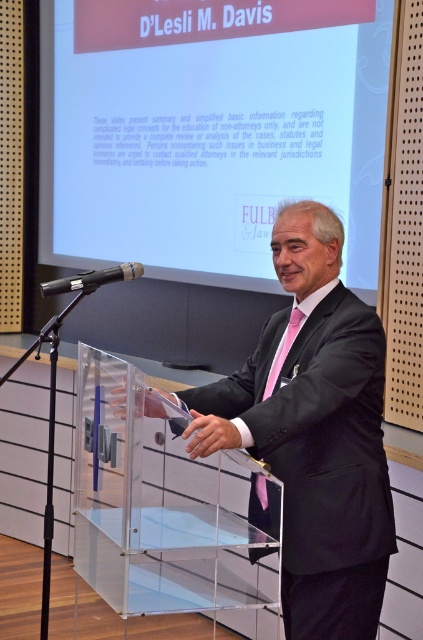
Question: Which of the following is the farthest from the observer?

Choices:
 (A) black glossy suit at center
 (B) black matte microphone at center
 (C) pink satin tie at center

Answer: (B)

Question: In this image, where is black glossy suit at center located relative to pink satin tie at center?

Choices:
 (A) above
 (B) below

Answer: (B)

Question: Which of the following is the closest to the observer?

Choices:
 (A) (249, 125)
 (B) (101, 273)
 (C) (337, 566)
 (D) (272, 388)

Answer: (C)

Question: Does white matte projection screen at upper center have a greater width compared to black glossy suit at center?

Choices:
 (A) yes
 (B) no

Answer: (A)

Question: Is the position of white matte projection screen at upper center less distant than that of black glossy suit at center?

Choices:
 (A) yes
 (B) no

Answer: (B)

Question: Which object appears closest to the camera in this image?

Choices:
 (A) pink satin tie at center
 (B) black matte microphone at center
 (C) white matte projection screen at upper center
 (D) black glossy suit at center

Answer: (D)